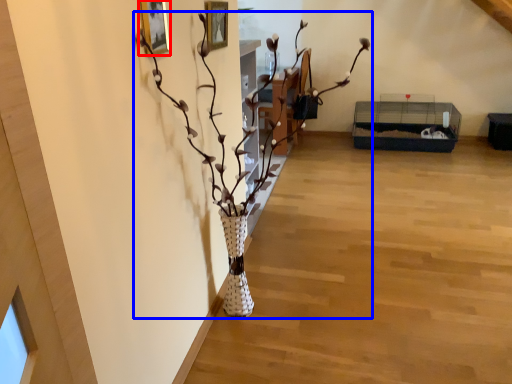
Question: Which of the following is the closest to the observer, picture frame (highlighted by a red box) or houseplant (highlighted by a blue box)?

Choices:
 (A) picture frame
 (B) houseplant

Answer: (B)